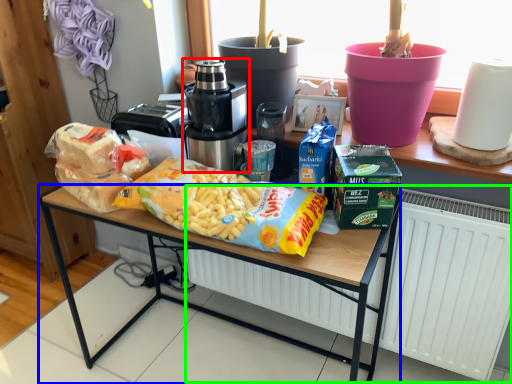
Question: Which object is positioned closest to home appliance (highlighted by a red box)? Select from desk (highlighted by a blue box) and radiator (highlighted by a green box).

Choices:
 (A) desk
 (B) radiator

Answer: (A)